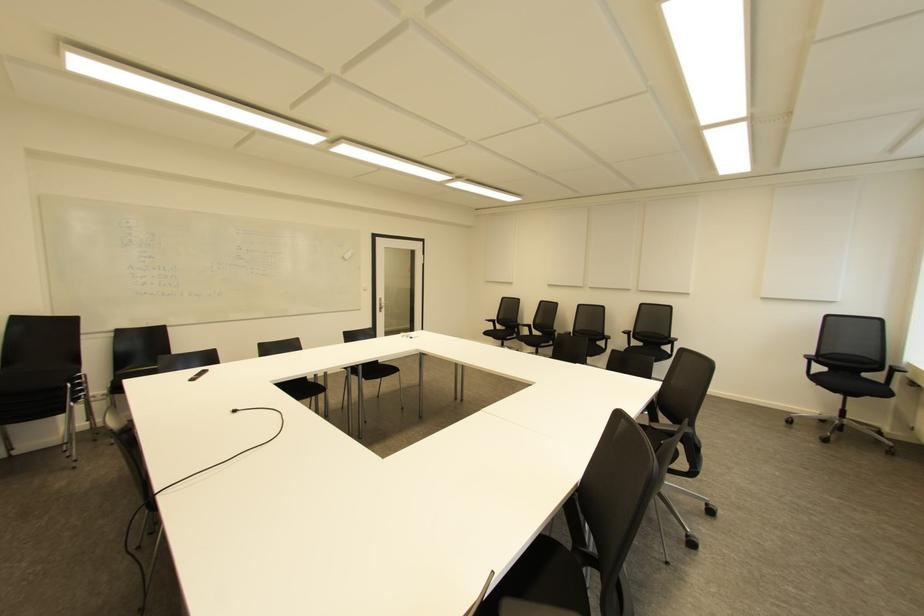
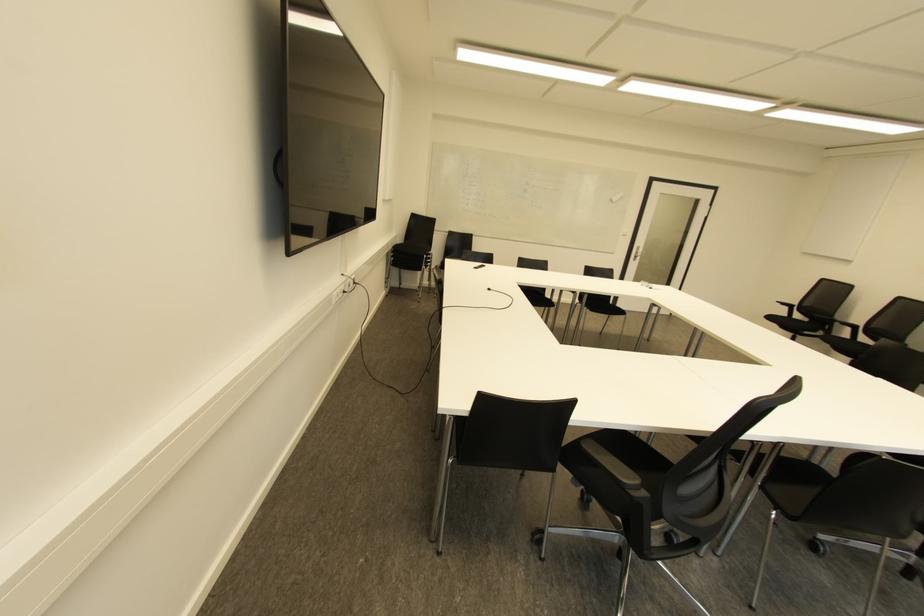
Where in the second image is the point corresponding to point 380,308 from the first image?

(636, 257)